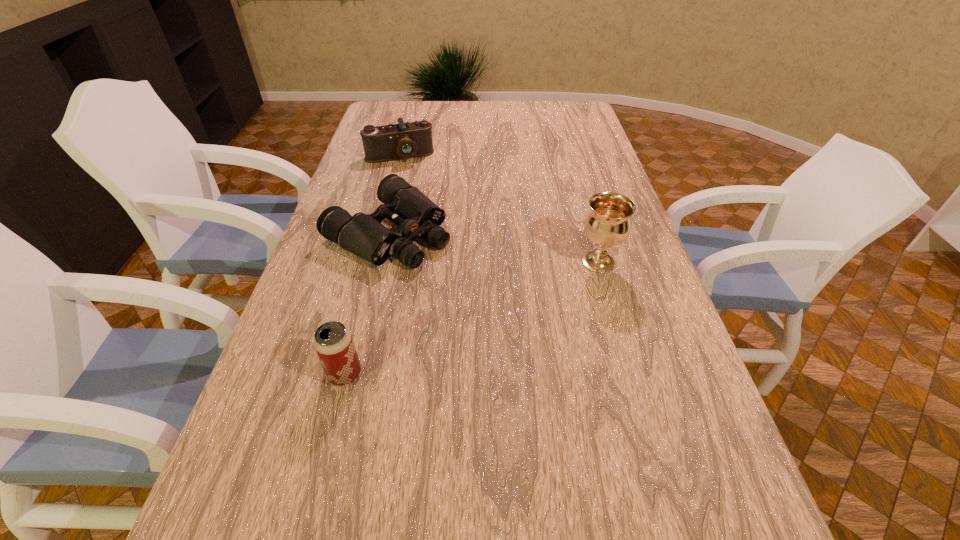
I want to click on blank region between the rightmost object and the farthest object, so pos(499,210).

Image resolution: width=960 pixels, height=540 pixels. I want to click on empty location between the camera and the rightmost object, so click(x=499, y=210).

Identify the location of object that is the third closest to the nearest object. (391, 142).

Identify which object is the second nearest to the farthest object. Please provide its 2D coordinates. Your answer should be formatted as a tuple, i.e. [(x, y)], where the tuple contains the x and y coordinates of a point satisfying the conditions above.

[(607, 224)]

Locate an element on the screen. free spot that satisfies the following two spatial constraints: 1. on the back side of the beer can; 2. on the left side of the chalice is located at coordinates (373, 262).

Identify the location of vacant position in the image that satisfies the following two spatial constraints: 1. on the back side of the beer can; 2. on the right side of the rightmost object. (373, 262).

Where is `vacant space that satisfies the following two spatial constraints: 1. on the front side of the camera; 2. on the left side of the tallest object`? The width and height of the screenshot is (960, 540). vacant space that satisfies the following two spatial constraints: 1. on the front side of the camera; 2. on the left side of the tallest object is located at coordinates (372, 262).